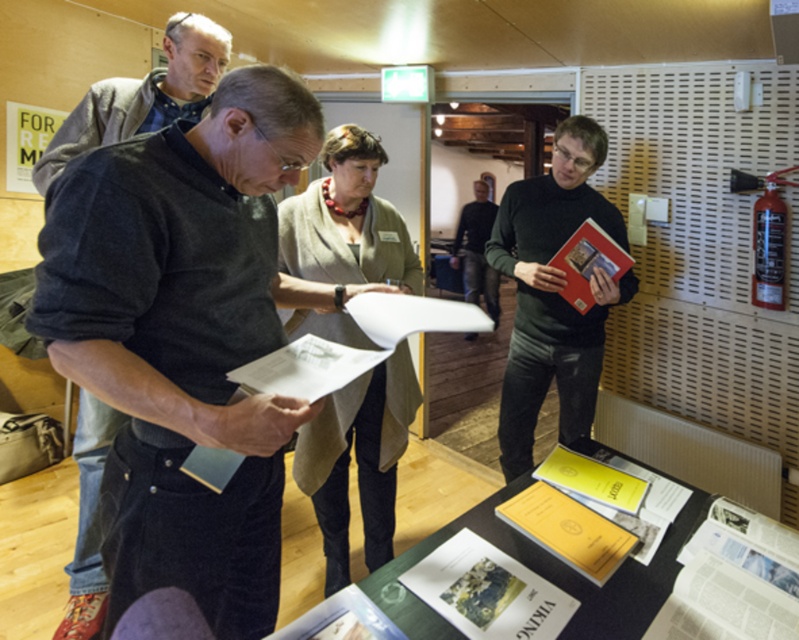
Looking at this image, you are standing at the point marked by the coordinates point (x=70, y=566). You want to walk to the other side of the room. There is a door 2.09 meters away from your current position. Can you reach the door without moving past the man in the foreground?

The distance between you and the door is 2.09 meters, which matches the distance stated in the objects description. Since the man in the foreground is part of the group but the exact positioning isn

You are organizing a display and need to place the matte black book at right and the dark gray sweater at center on a shelf. Which item should you place first if you want to arrange them from tallest to shortest?

The dark gray sweater at center should be placed first because it is taller than the matte black book at right.

You are standing at the center of the room and want to place a new object at the location of the matte black book at right. What are the coordinates where you should place it?

The coordinates for the matte black book at right are point (553, 292).